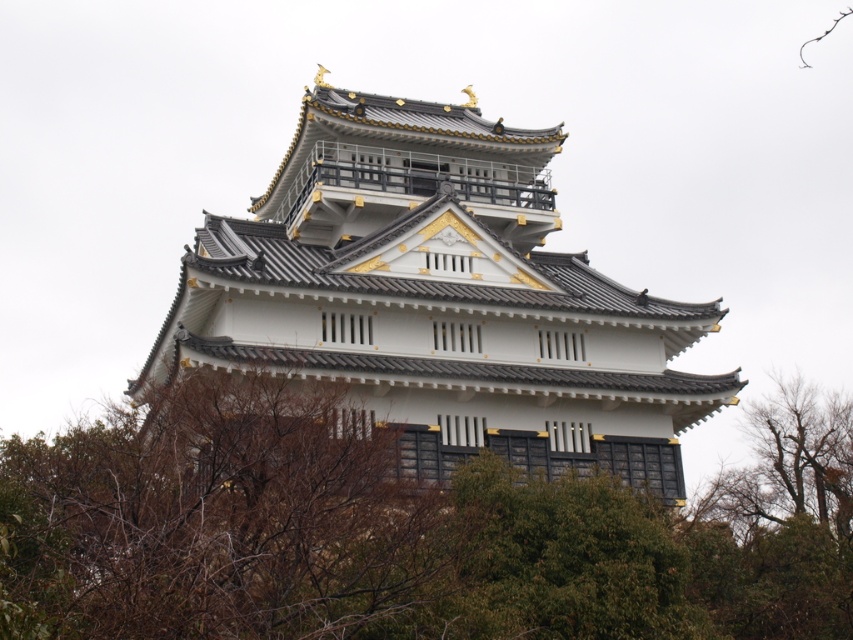
Which of these two, green leafy tree at center or white painted wood tower at center, stands shorter?

Standing shorter between the two is green leafy tree at center.

Which is more to the right, green leafy tree at center or white painted wood tower at center?

white painted wood tower at center

Find the location of a particular element. The height and width of the screenshot is (640, 853). green leafy tree at center is located at coordinates (381, 536).

Locate an element on the screen. The image size is (853, 640). green leafy tree at center is located at coordinates (381, 536).